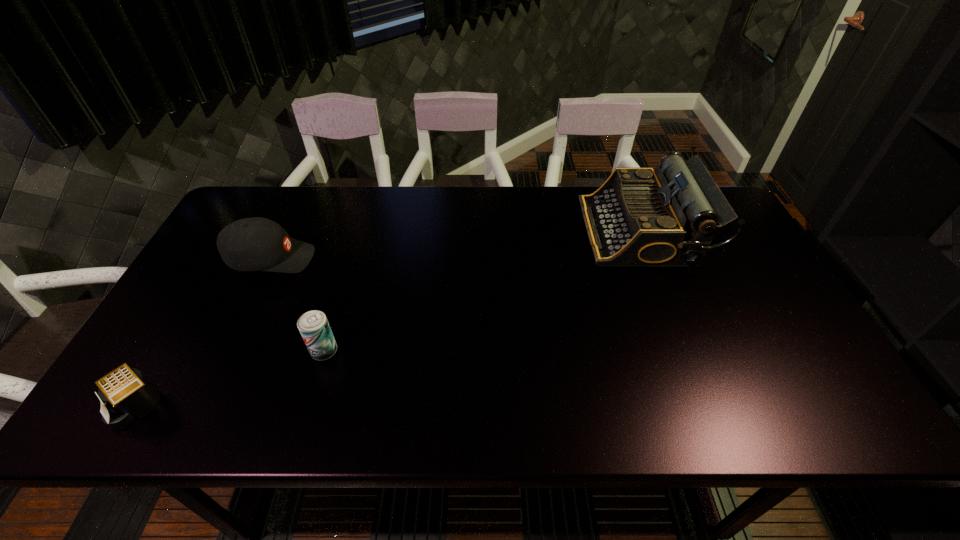
I want to click on free location located 0.340m with a logo on the front of the baseball cap, so click(x=432, y=259).

The width and height of the screenshot is (960, 540). In order to click on vacant position located on the left of the third object from left to right in this screenshot , I will do `click(224, 351)`.

Identify the location of vacant space located 0.170m on the back of the shortest object. (187, 323).

The height and width of the screenshot is (540, 960). Find the location of `object present at the far edge`. object present at the far edge is located at coordinates (639, 217).

Where is `object at the near edge`? Image resolution: width=960 pixels, height=540 pixels. object at the near edge is located at coordinates (128, 395).

You are a GUI agent. You are given a task and a screenshot of the screen. Output one action in this format:
    pyautogui.click(x=<x>, y=<y>)
    Task: Click on the baseball cap that is at the left edge
    
    Given the screenshot: What is the action you would take?
    251,244

I want to click on calculator present at the left edge, so click(128, 395).

Image resolution: width=960 pixels, height=540 pixels. Find the location of `object at the right edge`. object at the right edge is located at coordinates (639, 217).

Image resolution: width=960 pixels, height=540 pixels. In order to click on object that is at the near left corner in this screenshot , I will do `click(128, 395)`.

Identify the location of object that is positioned at the far right corner. (639, 217).